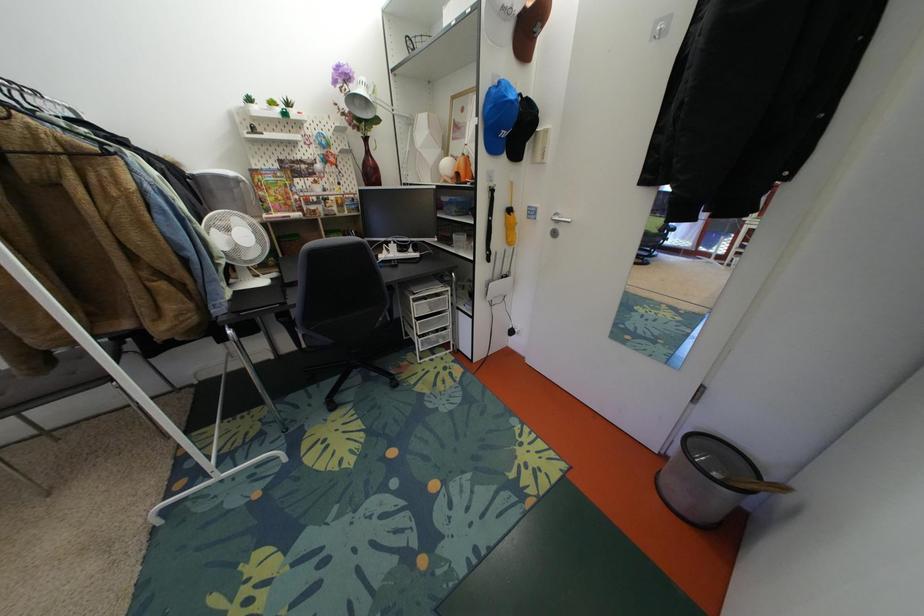
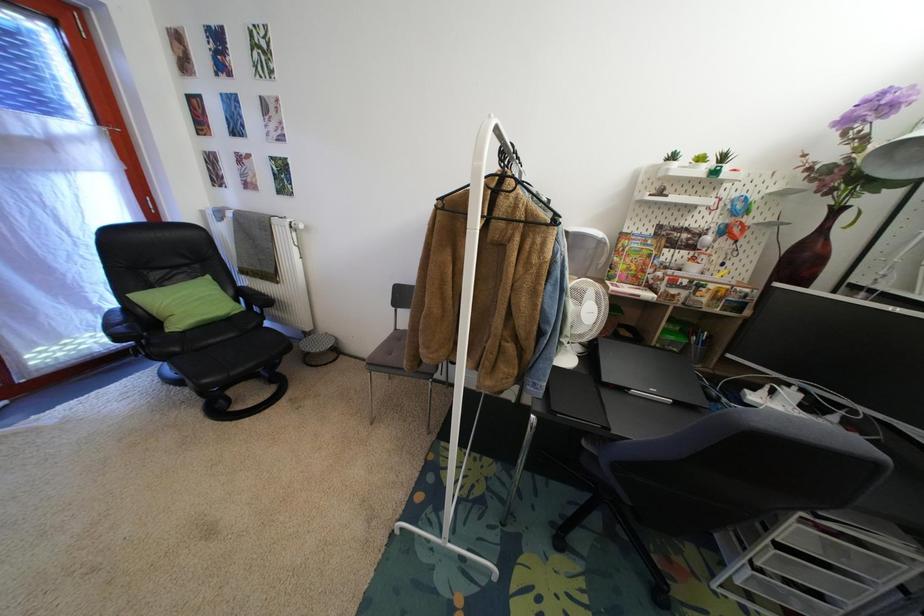
Question: Based on the continuous images, in which direction is the camera rotating? Reply with the corresponding letter.

Choices:
 (A) Left
 (B) Right
 (C) Up
 (D) Down

Answer: (A)